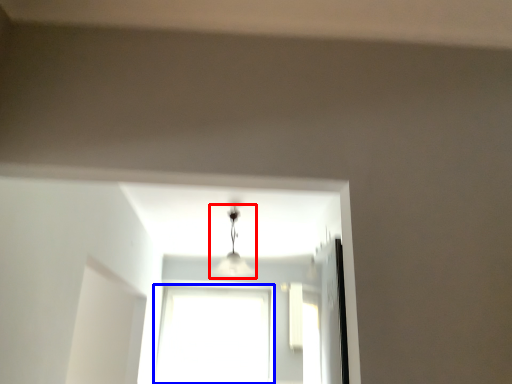
Question: Which point is closer to the camera, lamp (highlighted by a red box) or window (highlighted by a blue box)?

Choices:
 (A) lamp
 (B) window

Answer: (A)